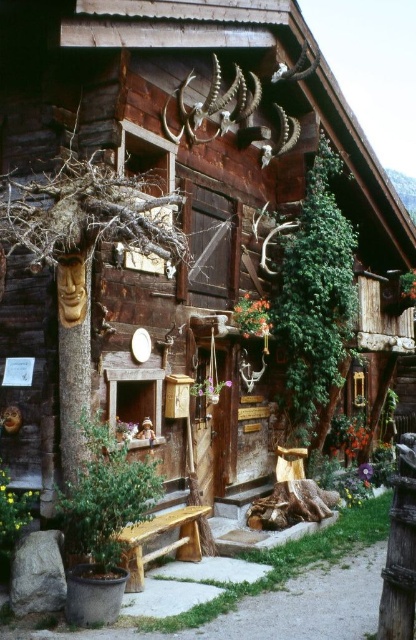
Between brown wood tree trunk at left and green leafy plant at right, which one has more height?

With more height is green leafy plant at right.

Where is `brown wood tree trunk at left`? brown wood tree trunk at left is located at coordinates (81, 259).

Identify the location of brown wood tree trunk at left. (81, 259).

Is brown wood tree trunk at left thinner than natural wood bench at center?

No.

Between brown wood tree trunk at left and natural wood bench at center, which one appears on the left side from the viewer's perspective?

Positioned to the left is brown wood tree trunk at left.

Who is more forward, [9,241] or [195,509]?

Point [9,241] is in front.

Find the location of `brown wood tree trunk at left`. brown wood tree trunk at left is located at coordinates (81, 259).

Consider the image. Who is positioned more to the left, green leafy plant at right or natural wood bench at center?

From the viewer's perspective, natural wood bench at center appears more on the left side.

Is point (307, 426) closer to camera compared to point (190, 547)?

No, it is behind (190, 547).

The width and height of the screenshot is (416, 640). I want to click on green leafy plant at right, so click(314, 304).